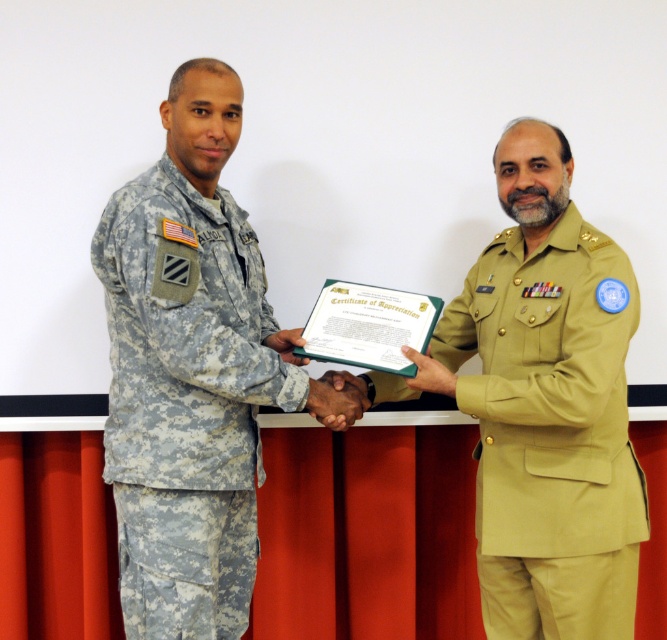
Question: Can you confirm if camouflage fabric uniform at left is positioned above khaki fabric uniform at right?

Choices:
 (A) no
 (B) yes

Answer: (B)

Question: Which point is closer to the camera?

Choices:
 (A) (175, 356)
 (B) (520, 358)

Answer: (A)

Question: Is camouflage fabric uniform at left positioned in front of khaki fabric uniform at right?

Choices:
 (A) yes
 (B) no

Answer: (A)

Question: Observing the image, what is the correct spatial positioning of camouflage fabric uniform at left in reference to khaki fabric uniform at right?

Choices:
 (A) right
 (B) left

Answer: (B)